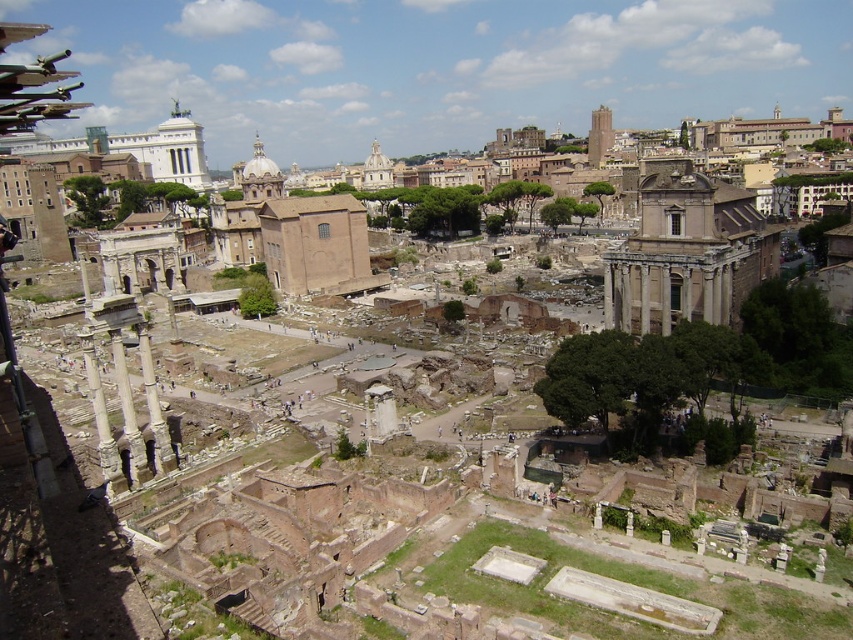
You are standing at the Roman Forum and want to take a photo of a specific point located at coordinates point (680, 168). If your camera has a maximum focus range of 120 meters, will it be able to focus on that point?

The point (680, 168) is 124.88 meters away from the camera, which exceeds the camera maximum focus range of 120 meters. Therefore, the camera will not be able to focus on that point.

You are a tourist standing at the Roman Forum and want to take a photo that includes both the light brown stone columns at center right and the white marble pillar at center. Which object should you position closer to the bottom of your camera frame to ensure both are fully visible?

To ensure both the light brown stone columns at center right and the white marble pillar at center are fully visible in your photo, position the white marble pillar at center closer to the bottom of the frame since it is shorter than the light brown stone columns at center right.

You are standing at the Roman Forum and see the white marble pillar at lower left and the white marble pillar at center. Which pillar is positioned higher up in the image?

The white marble pillar at lower left is positioned higher up in the image than the white marble pillar at center.